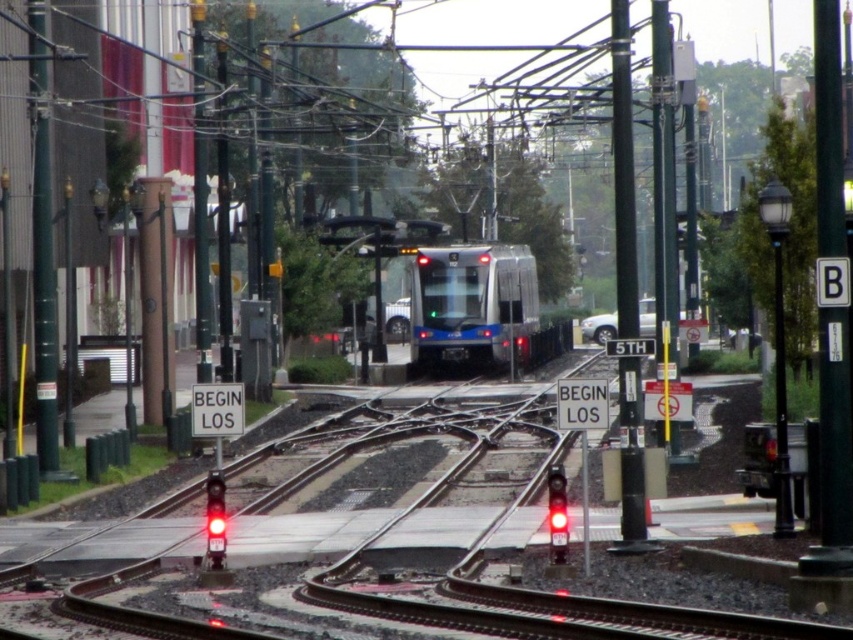
Question: Is the position of metallic pole at right less distant than that of red glass traffic light at lower left?

Choices:
 (A) no
 (B) yes

Answer: (A)

Question: Which of the following is the closest to the observer?

Choices:
 (A) metallic pole at right
 (B) red glass traffic light at center
 (C) black metal pole at center right
 (D) metallic silver train at center

Answer: (C)

Question: Based on their relative distances, which object is nearer to the metallic pole at right?

Choices:
 (A) red glass traffic light at center
 (B) red glass traffic light at lower left
 (C) metallic silver train at center
 (D) black metal pole at center right

Answer: (D)

Question: From the image, what is the correct spatial relationship of metallic silver train at center in relation to black metal pole at center right?

Choices:
 (A) below
 (B) above

Answer: (A)

Question: Observing the image, what is the correct spatial positioning of metallic pole at right in reference to red glass traffic light at center?

Choices:
 (A) below
 (B) above

Answer: (B)

Question: Which point is closer to the camera taking this photo?

Choices:
 (A) (432, 323)
 (B) (625, 220)
 (C) (671, 35)

Answer: (B)